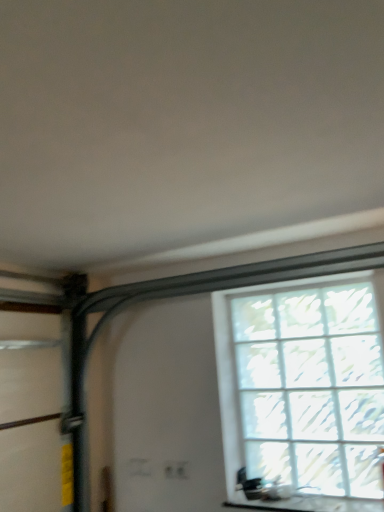
This screenshot has width=384, height=512. What do you see at coordinates (304, 388) in the screenshot? I see `clear glass window at upper right` at bounding box center [304, 388].

In order to face clear glass window at upper right, should I rotate leftwards or rightwards?

It's best to rotate right around 15.035 degrees.

Measure the distance between clear glass window at upper right and camera.

The depth of clear glass window at upper right is 6.07 feet.

I want to click on clear glass window at upper right, so [304, 388].

This screenshot has width=384, height=512. In order to click on clear glass window at upper right in this screenshot , I will do `click(304, 388)`.